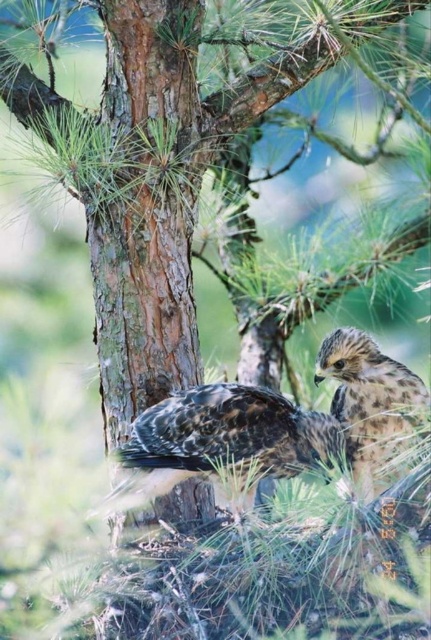
Question: Considering the relative positions of brown speckled feathers at center and speckled brown eagle at right in the image provided, where is brown speckled feathers at center located with respect to speckled brown eagle at right?

Choices:
 (A) below
 (B) above

Answer: (A)

Question: Can you confirm if brown speckled feathers at center is positioned below speckled brown eagle at right?

Choices:
 (A) no
 (B) yes

Answer: (B)

Question: Which of the following is the closest to the observer?

Choices:
 (A) (131, 490)
 (B) (349, 396)

Answer: (B)

Question: Can you confirm if brown speckled feathers at center is positioned above speckled brown eagle at right?

Choices:
 (A) no
 (B) yes

Answer: (A)

Question: Among these objects, which one is farthest from the camera?

Choices:
 (A) speckled brown eagle at right
 (B) brown speckled feathers at center

Answer: (B)